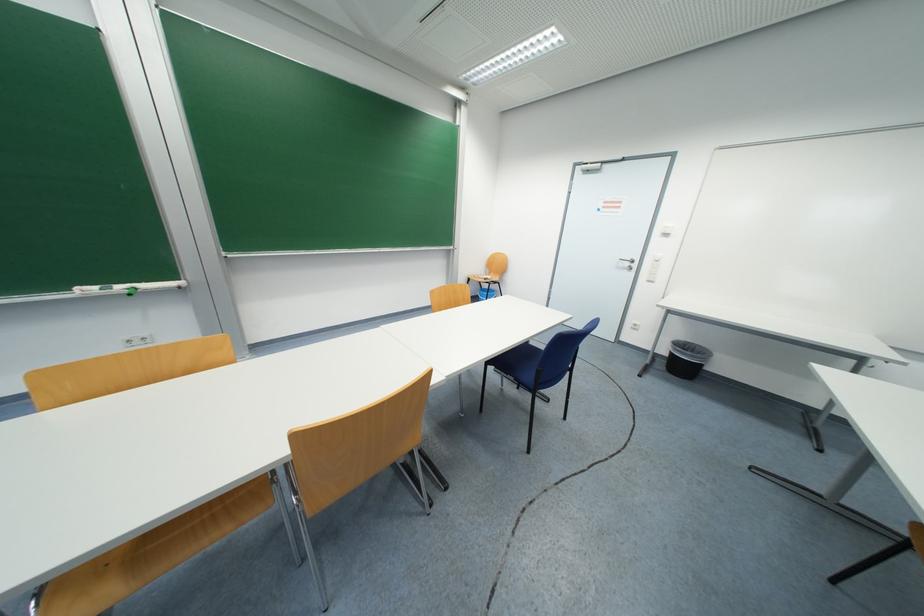
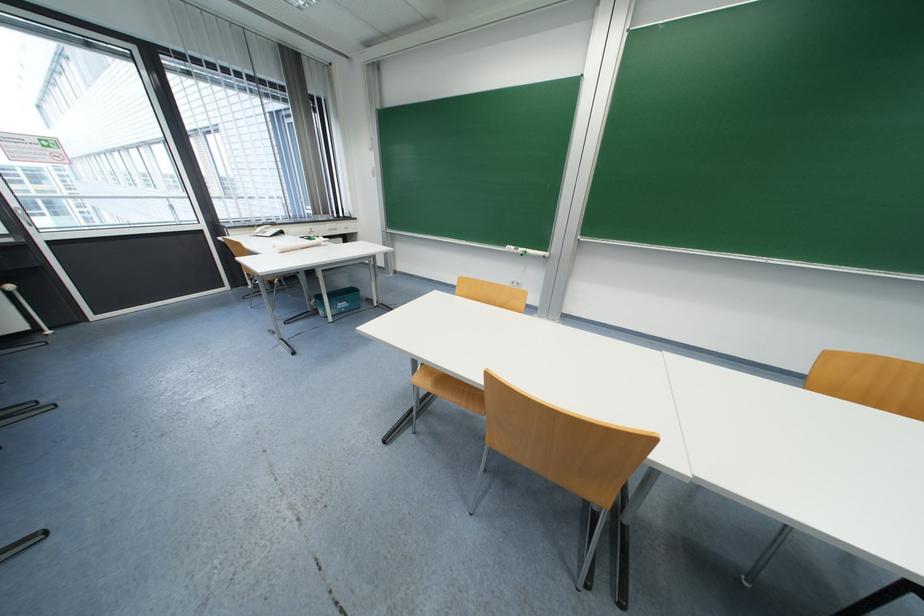
Question: The camera is either moving clockwise (left) or counter-clockwise (right) around the object. The first image is from the beginning of the video and the second image is from the end. Is the camera moving left or right when shooting the video?

Choices:
 (A) Left
 (B) Right

Answer: (B)